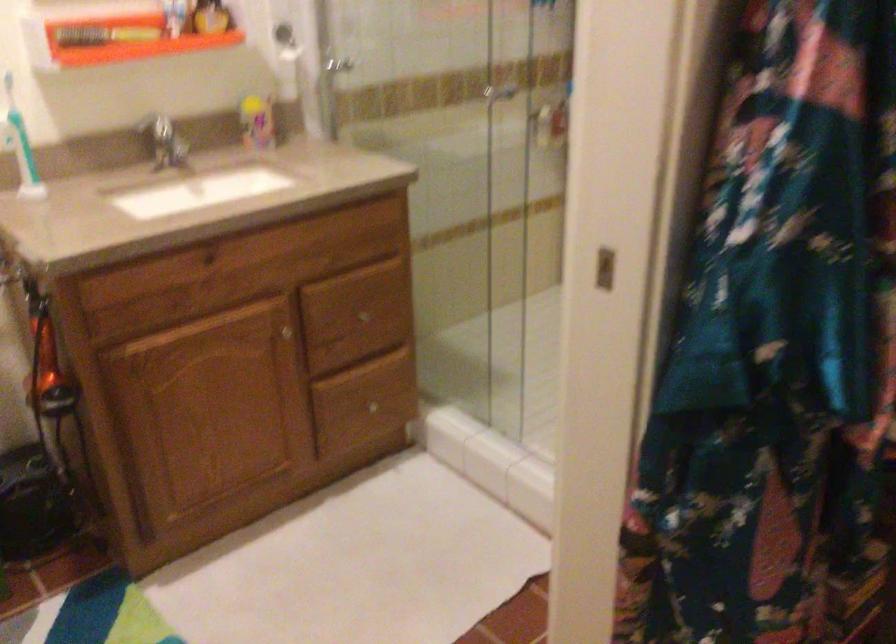
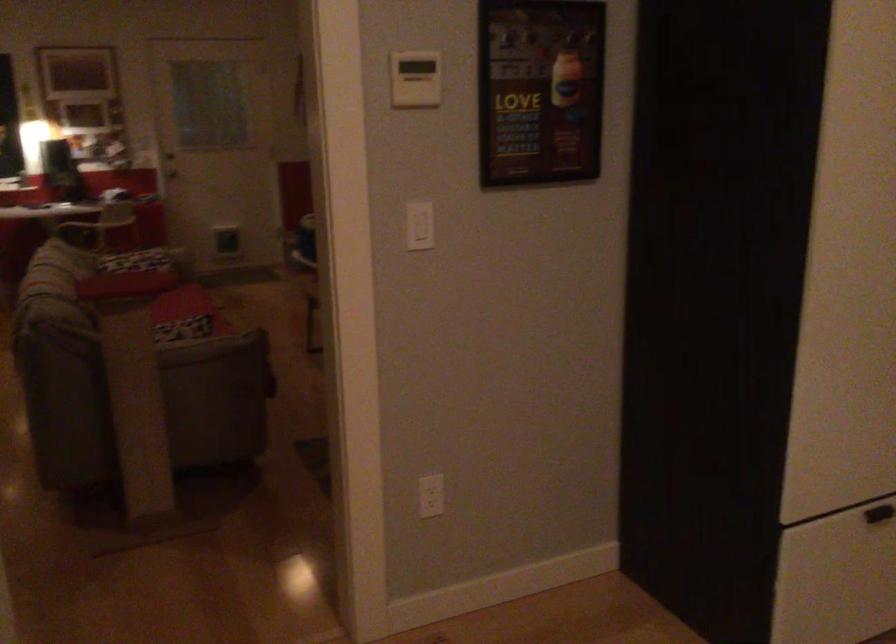
Question: The camera is either moving clockwise (left) or counter-clockwise (right) around the object. The first image is from the beginning of the video and the second image is from the end. Is the camera moving left or right when shooting the video?

Choices:
 (A) Left
 (B) Right

Answer: (A)